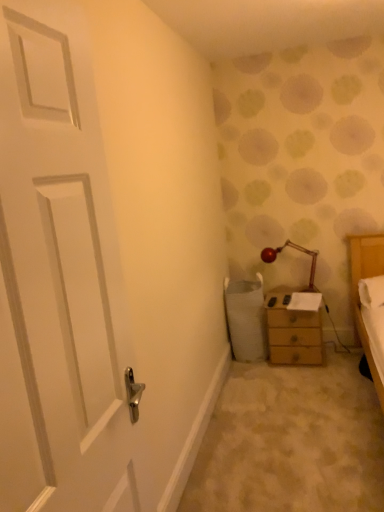
Find the location of a particular element. This screenshot has height=512, width=384. free location in front of wooden chest of drawers at right is located at coordinates (310, 380).